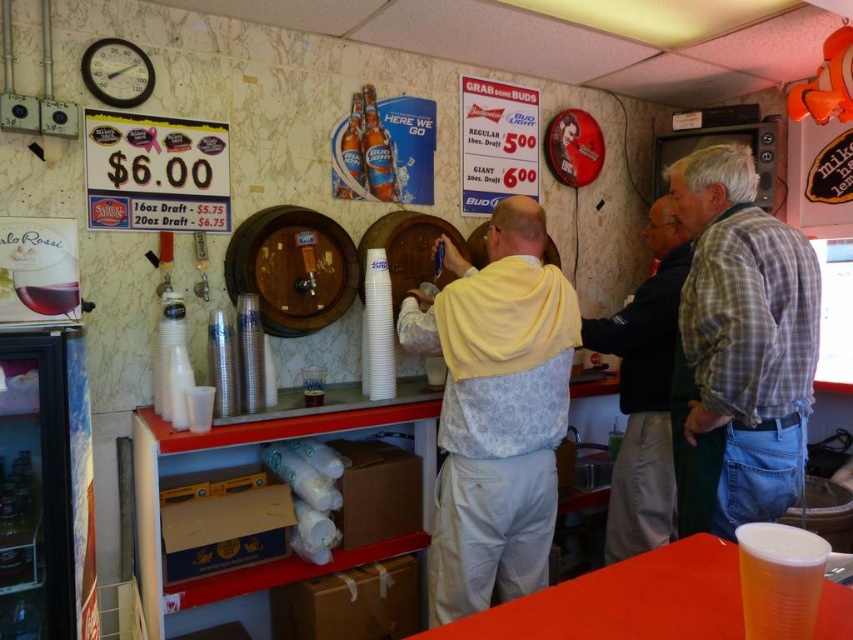
Question: Can you confirm if light yellow hoodie at center is positioned to the right of dark gray sweater at center?

Choices:
 (A) yes
 (B) no

Answer: (A)

Question: Which of these objects is positioned farthest from the dark gray sweater at center?

Choices:
 (A) light yellow hoodie at center
 (B) light yellow fabric at center

Answer: (B)

Question: Can you confirm if light yellow hoodie at center is smaller than dark gray sweater at center?

Choices:
 (A) no
 (B) yes

Answer: (A)

Question: Which of these objects is positioned closest to the light yellow hoodie at center?

Choices:
 (A) light yellow fabric at center
 (B) plaid shirt at right

Answer: (B)

Question: Is plaid shirt at right wider than dark gray sweater at center?

Choices:
 (A) yes
 (B) no

Answer: (B)

Question: Based on their relative distances, which object is farther from the dark gray sweater at center?

Choices:
 (A) light yellow fabric at center
 (B) plaid shirt at right
 (C) light yellow hoodie at center

Answer: (A)